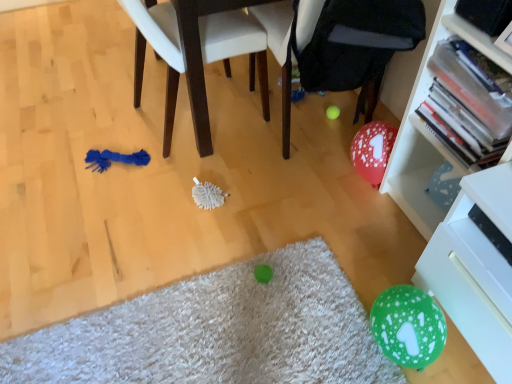
Identify the location of free space to the left of white bristle brush at center. The width and height of the screenshot is (512, 384). (166, 197).